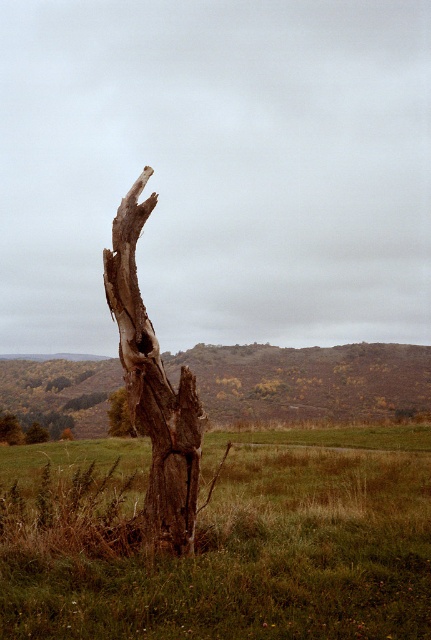
You are an environmental scientist examining the image of the desolate landscape. You notice the brown rough bark tree trunk at center and the brown rough bark tree at center. Which of the two has a smaller diameter?

The brown rough bark tree trunk at center is thinner than the brown rough bark tree at center, so the brown rough bark tree trunk at center has a smaller diameter.

You are standing at the center of the image and want to walk towards the brown rough bark tree trunk at center. In which direction should you move?

The brown rough bark tree trunk at center is already at the center of the image, so you are already facing it. You don not need to move in any direction.